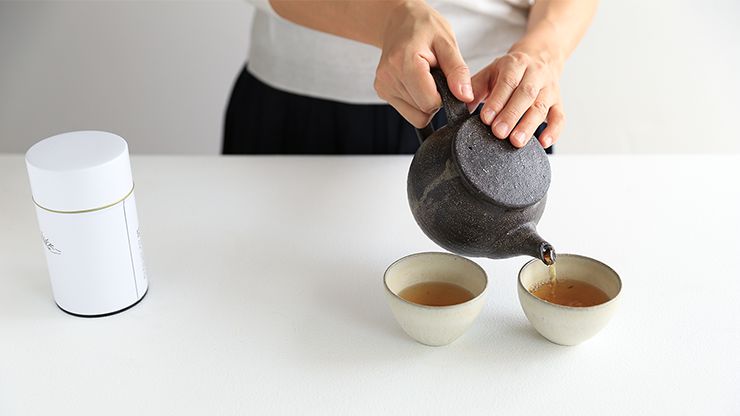
Locate an element on the screen. The image size is (740, 416). tea in cup on the right is located at coordinates 585,292, 567,286.